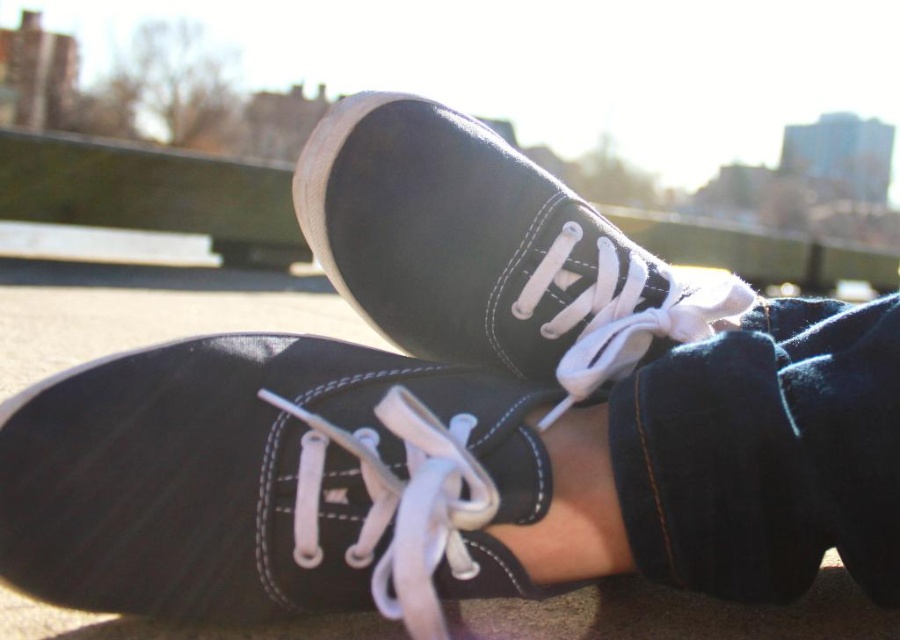
You are a photographer trying to capture the perfect shot of the matte black shoe at center and the matte black sneaker at center. Since you want to highlight their height differences, which object should you focus on to emphasize its taller feature?

The matte black sneaker at center is taller than the matte black shoe at center, so focusing on the matte black sneaker at center will emphasize its taller feature.

You are trying to decide which shoe to wear for a walk. You see a matte black shoe at center and a matte black sneaker at center. Which one is on the left?

The matte black shoe at center is positioned on the left side of the matte black sneaker at center.